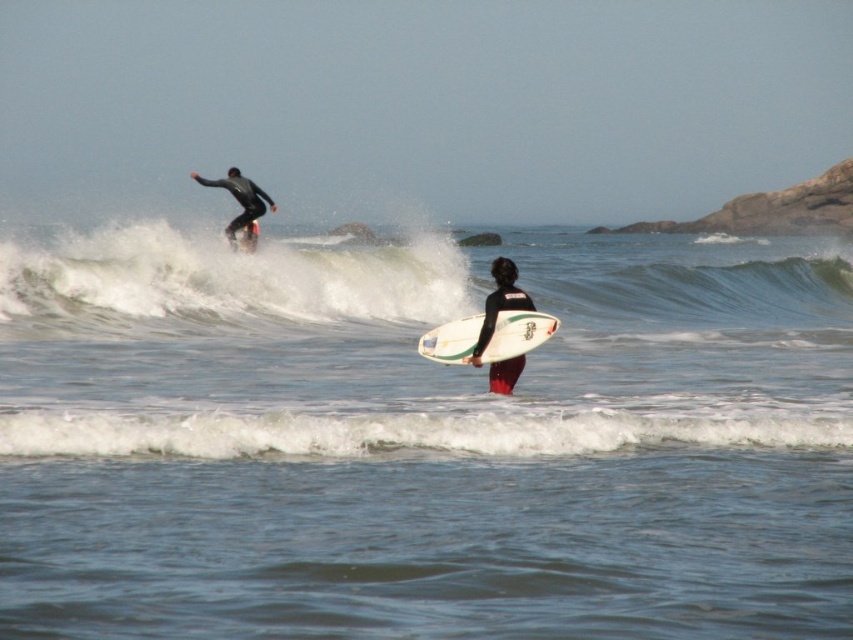
Who is positioned more to the right, white smooth wave at center or black matte wetsuit at upper left?

white smooth wave at center is more to the right.

Is point (837, 321) positioned before point (247, 182)?

Yes, point (837, 321) is in front of point (247, 182).

Find the location of a particular element. white smooth wave at center is located at coordinates pyautogui.click(x=405, y=282).

What do you see at coordinates (422, 440) in the screenshot? Image resolution: width=853 pixels, height=640 pixels. I see `clear blue water at center` at bounding box center [422, 440].

Who is lower down, clear blue water at center or white smooth wave at center?

clear blue water at center

The image size is (853, 640). Find the location of `clear blue water at center`. clear blue water at center is located at coordinates (422, 440).

From the picture: Which is more to the right, clear blue water at center or black matte wetsuit at center?

Positioned to the right is clear blue water at center.

Image resolution: width=853 pixels, height=640 pixels. What do you see at coordinates (422, 440) in the screenshot?
I see `clear blue water at center` at bounding box center [422, 440].

Locate an element on the screen. The width and height of the screenshot is (853, 640). clear blue water at center is located at coordinates (422, 440).